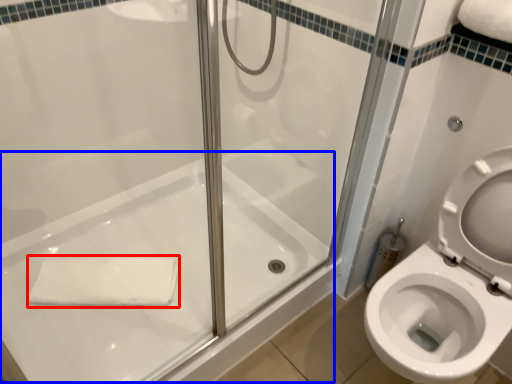
Question: Which object is further to the camera taking this photo, bath towel (highlighted by a red box) or bath (highlighted by a blue box)?

Choices:
 (A) bath towel
 (B) bath

Answer: (A)